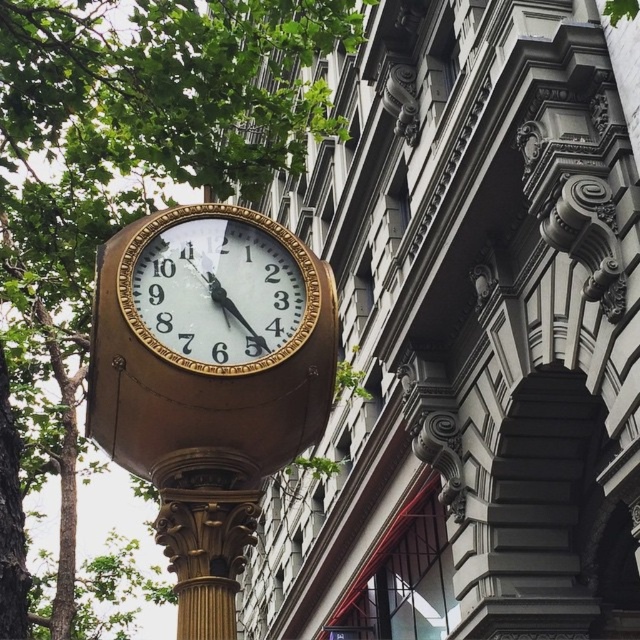
Question: Is green leafy tree at upper left closer to the viewer compared to gold polished clock at center?

Choices:
 (A) yes
 (B) no

Answer: (B)

Question: Does green leafy tree at upper left lie behind gold polished clock at center?

Choices:
 (A) yes
 (B) no

Answer: (A)

Question: Estimate the real-world distances between objects in this image. Which object is closer to the gold polished clock at center?

Choices:
 (A) gold-bronze clock at center
 (B) green leafy tree at upper left

Answer: (A)

Question: Does green leafy tree at upper left appear under gold-bronze clock at center?

Choices:
 (A) yes
 (B) no

Answer: (B)

Question: Which of the following is the closest to the observer?

Choices:
 (A) green leafy tree at upper left
 (B) gold-bronze clock at center
 (C) gold polished clock at center

Answer: (B)

Question: Which point appears closest to the camera in this image?

Choices:
 (A) (268, 368)
 (B) (173, 264)
 (C) (248, 32)

Answer: (A)